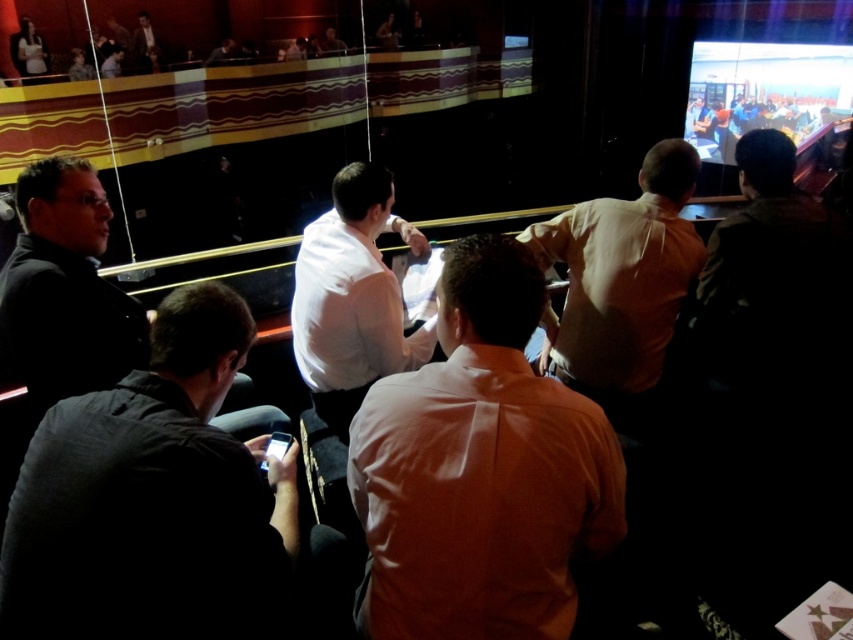
You are attending an event in this theater and want to take a photo of both the dark gray shirt at lower left and the matte white shirt at upper left. Which person should you focus on first to ensure both are in the frame?

You should focus on the matte white shirt at upper left first because the dark gray shirt at lower left is located below it, ensuring both will be captured in the frame when centered on the upper shirt.

You are sitting in the theater and want to take a photo of the stage. There is a person wearing a white smooth shirt at center in front of you. Based on their position, will they block your view of the stage?

The white smooth shirt at center is located at point 0.415 on the y axis, which is below the stage area. Therefore, they will not block your view of the stage.